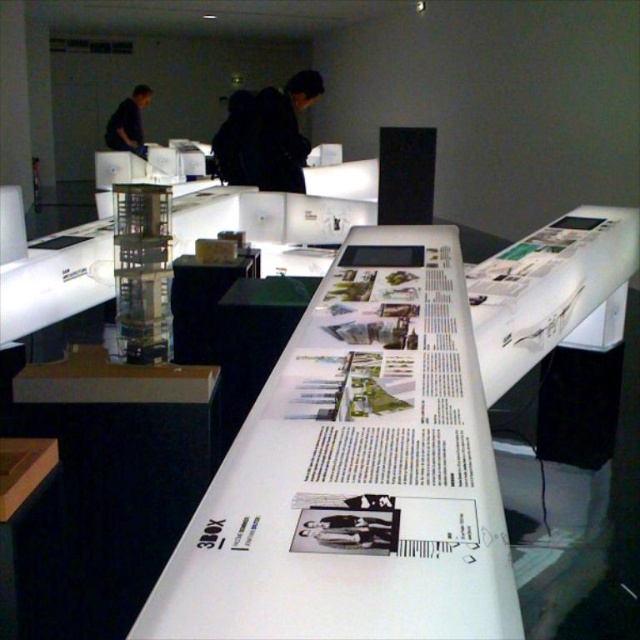
Can you confirm if white glossy table at center is smaller than dark blue shirt at upper left?

Indeed, white glossy table at center has a smaller size compared to dark blue shirt at upper left.

Is point (307, 598) farther from viewer compared to point (141, 108)?

No, (307, 598) is closer to viewer.

Who is more forward, (330, 282) or (138, 129)?

Point (330, 282) is in front.

Find the location of a particular element. The width and height of the screenshot is (640, 640). white glossy table at center is located at coordinates (385, 442).

Can you confirm if white glossy table at center is positioned below black fabric at upper center?

Yes.

Between white glossy table at center and black fabric at upper center, which one appears on the left side from the viewer's perspective?

From the viewer's perspective, black fabric at upper center appears more on the left side.

The image size is (640, 640). I want to click on white glossy table at center, so (385, 442).

Between point (269, 161) and point (141, 92), which one is positioned behind?

Point (141, 92)

Is black fabric at upper center above dark blue shirt at upper left?

Incorrect, black fabric at upper center is not positioned above dark blue shirt at upper left.

Is point (294, 161) farther from camera compared to point (141, 108)?

No, (294, 161) is in front of (141, 108).

Find the location of a particular element. black fabric at upper center is located at coordinates (280, 132).